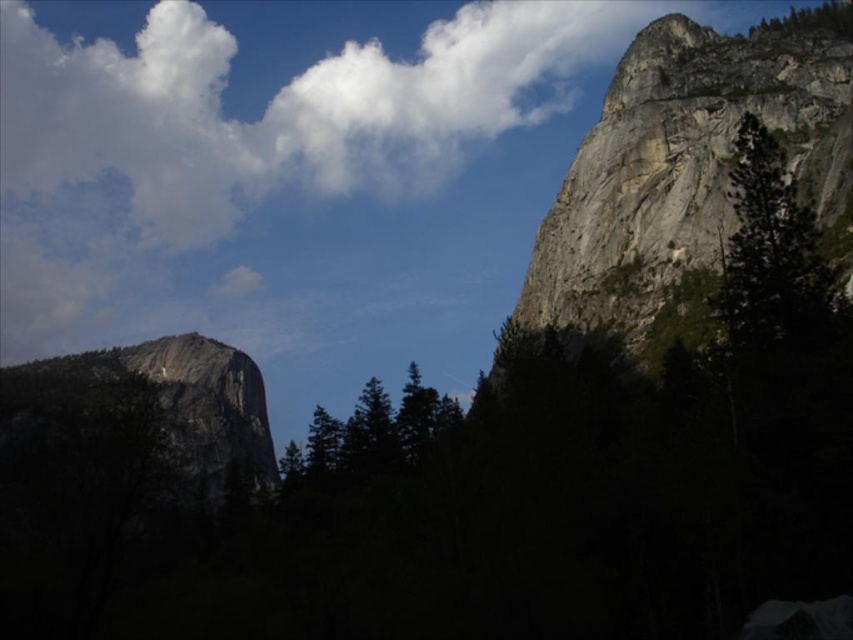
Does rugged granite mountain at left appear on the right side of green matte tree at center?

Incorrect, rugged granite mountain at left is not on the right side of green matte tree at center.

What do you see at coordinates (173, 403) in the screenshot?
I see `rugged granite mountain at left` at bounding box center [173, 403].

Is point (35, 378) positioned before point (380, 420)?

No, (35, 378) is further to viewer.

You are a GUI agent. You are given a task and a screenshot of the screen. Output one action in this format:
    pyautogui.click(x=<x>, y=<y>)
    Task: Click on the rugged granite mountain at left
    This screenshot has width=853, height=640.
    Given the screenshot: What is the action you would take?
    pyautogui.click(x=173, y=403)

Does rocky cliff at upper right have a lesser height compared to green matte tree at center?

No, rocky cliff at upper right is not shorter than green matte tree at center.

Which of these two, rocky cliff at upper right or green matte tree at center, stands taller?

With more height is rocky cliff at upper right.

Measure the distance between point (670,202) and camera.

Point (670,202) is 116.98 meters away from camera.

You are a GUI agent. You are given a task and a screenshot of the screen. Output one action in this format:
    pyautogui.click(x=<x>, y=<y>)
    Task: Click on the rocky cliff at upper right
    This screenshot has width=853, height=640.
    Given the screenshot: What is the action you would take?
    pyautogui.click(x=682, y=163)

Is rugged granite mountain at left positioned in front of green textured tree at upper right?

No, it is not.

Who is more forward, (172, 452) or (848, 35)?

Point (848, 35) is more forward.

This screenshot has height=640, width=853. I want to click on rugged granite mountain at left, so click(x=173, y=403).

This screenshot has height=640, width=853. Identify the location of rugged granite mountain at left. (173, 403).